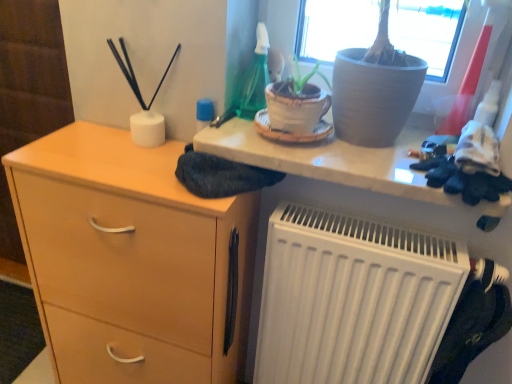
Identify the location of free spot above matte gray pot at upper center (from a real-world perspective). The image size is (512, 384). (333, 140).